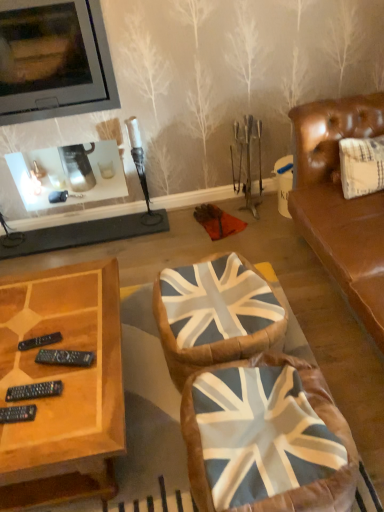
Question: Is union jack fabric swivel chair at center, which appears as the 2th swivel chair when viewed from the back, shorter than matte black television at upper left?

Choices:
 (A) no
 (B) yes

Answer: (B)

Question: Is matte black television at upper left completely or partially inside union jack fabric swivel chair at center, the 1th swivel chair positioned from the front?

Choices:
 (A) no
 (B) yes

Answer: (A)

Question: Is union jack fabric swivel chair at center, which appears as the 2th swivel chair when viewed from the back, oriented away from matte black television at upper left?

Choices:
 (A) yes
 (B) no

Answer: (B)

Question: Are union jack fabric swivel chair at center, which appears as the 2th swivel chair when viewed from the back, and matte black television at upper left far apart?

Choices:
 (A) yes
 (B) no

Answer: (A)

Question: Can you confirm if union jack fabric swivel chair at center, which appears as the 2th swivel chair when viewed from the back, is positioned to the right of matte black television at upper left?

Choices:
 (A) no
 (B) yes

Answer: (B)

Question: Could you tell me if union jack fabric swivel chair at center, the 1th swivel chair positioned from the front, is facing matte black television at upper left?

Choices:
 (A) no
 (B) yes

Answer: (A)

Question: From the image's perspective, is union jack fabric swivel chair at center, the 1th swivel chair positioned from the front, on union jack fabric swivel chair at center, the 1th swivel chair when ordered from back to front?

Choices:
 (A) no
 (B) yes

Answer: (A)

Question: Is union jack fabric swivel chair at center, which appears as the 2th swivel chair when viewed from the back, shorter than union jack fabric swivel chair at center, the second swivel chair when ordered from front to back?

Choices:
 (A) no
 (B) yes

Answer: (A)

Question: Is union jack fabric swivel chair at center, which appears as the 2th swivel chair when viewed from the back, to the right of union jack fabric swivel chair at center, the second swivel chair when ordered from front to back, from the viewer's perspective?

Choices:
 (A) yes
 (B) no

Answer: (A)

Question: Could you tell me if union jack fabric swivel chair at center, the 1th swivel chair positioned from the front, is turned towards union jack fabric swivel chair at center, the 1th swivel chair when ordered from back to front?

Choices:
 (A) no
 (B) yes

Answer: (A)

Question: Considering the relative sizes of union jack fabric swivel chair at center, which appears as the 2th swivel chair when viewed from the back, and union jack fabric swivel chair at center, the 1th swivel chair when ordered from back to front, in the image provided, is union jack fabric swivel chair at center, which appears as the 2th swivel chair when viewed from the back, bigger than union jack fabric swivel chair at center, the 1th swivel chair when ordered from back to front,?

Choices:
 (A) no
 (B) yes

Answer: (B)

Question: Would you say union jack fabric swivel chair at center, the 1th swivel chair positioned from the front, is a long distance from union jack fabric swivel chair at center, the second swivel chair when ordered from front to back?

Choices:
 (A) yes
 (B) no

Answer: (B)

Question: From a real-world perspective, is matte black television at upper left on top of union jack fabric swivel chair at center, the 1th swivel chair positioned from the front?

Choices:
 (A) no
 (B) yes

Answer: (B)